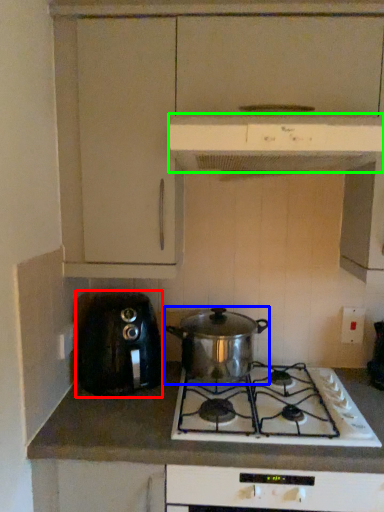
Question: Based on their relative distances, which object is farther from toaster (highlighted by a red box)? Choose from kitchen appliance (highlighted by a blue box) and kitchen appliance (highlighted by a green box).

Choices:
 (A) kitchen appliance
 (B) kitchen appliance

Answer: (B)